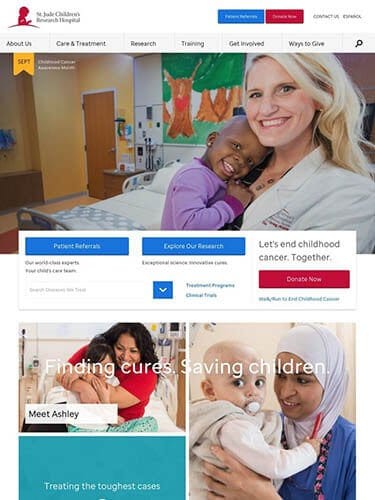
Locate an element on the screen. The width and height of the screenshot is (375, 500). patient bed is located at coordinates [x=127, y=206], [x=160, y=401].